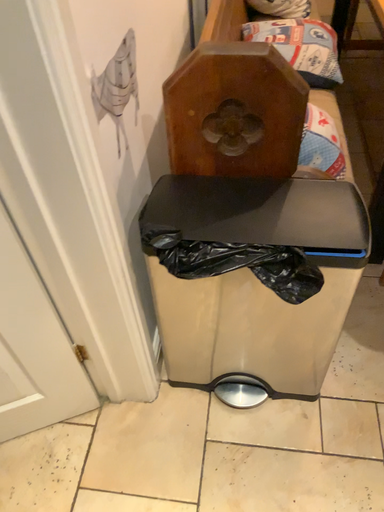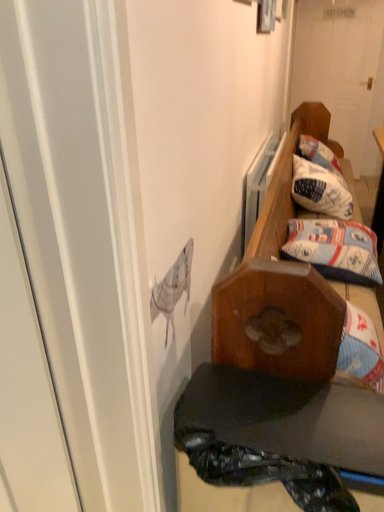
Question: How did the camera likely rotate when shooting the video?

Choices:
 (A) rotated upward
 (B) rotated downward

Answer: (A)